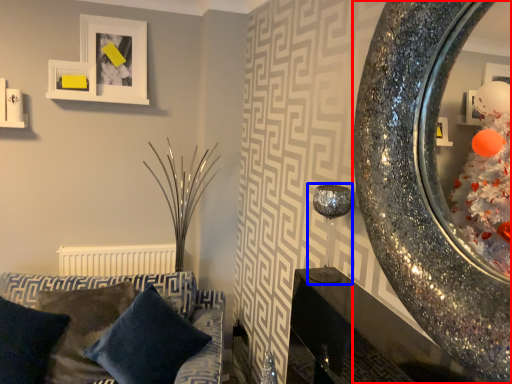
Question: Which object is further to the camera taking this photo, mirror (highlighted by a red box) or candle holder (highlighted by a blue box)?

Choices:
 (A) mirror
 (B) candle holder

Answer: (B)